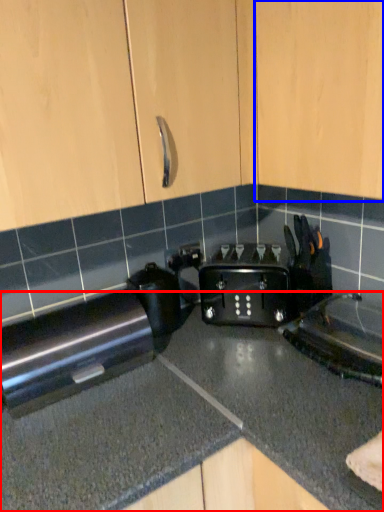
Question: Among these objects, which one is nearest to the camera, countertop (highlighted by a red box) or cabinetry (highlighted by a blue box)?

Choices:
 (A) countertop
 (B) cabinetry

Answer: (A)